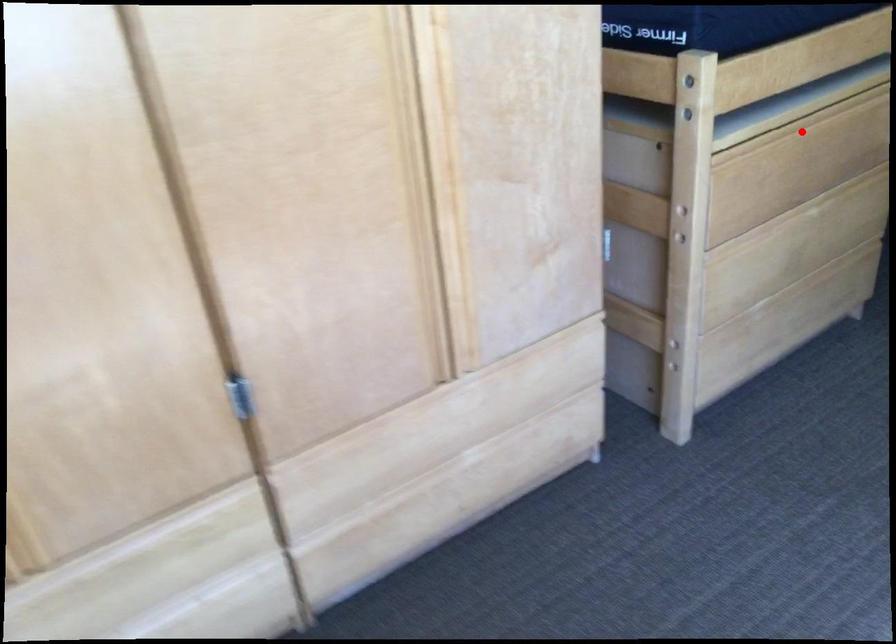
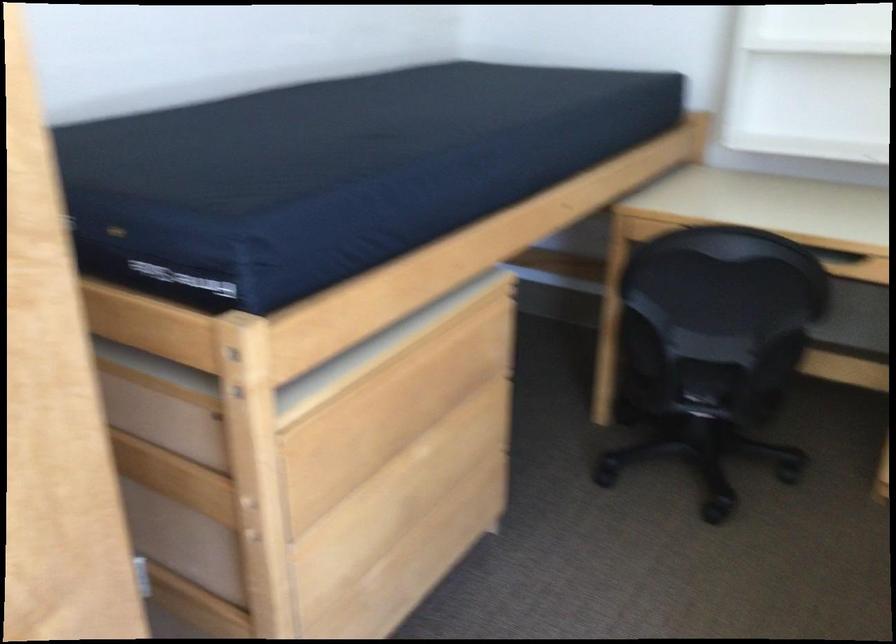
Locate, in the second image, the point that corresponds to the highlighted location in the first image.

(403, 379)